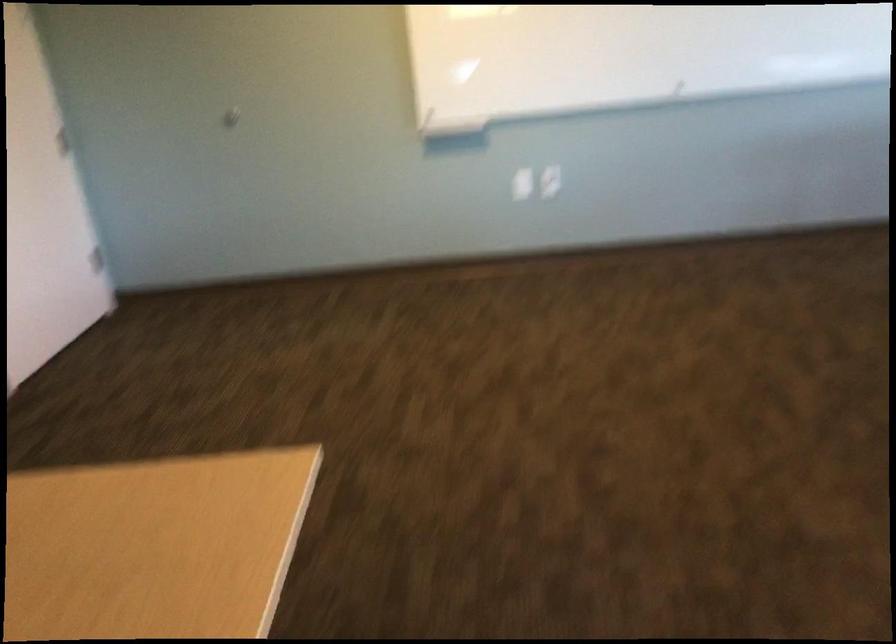
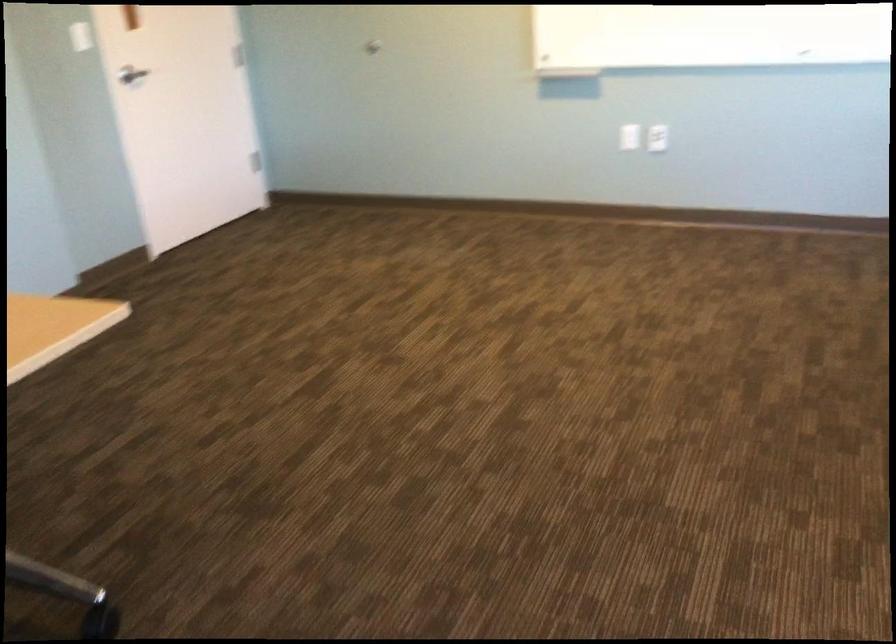
In the second image, find the point that corresponds to point 549,187 in the first image.

(657, 138)